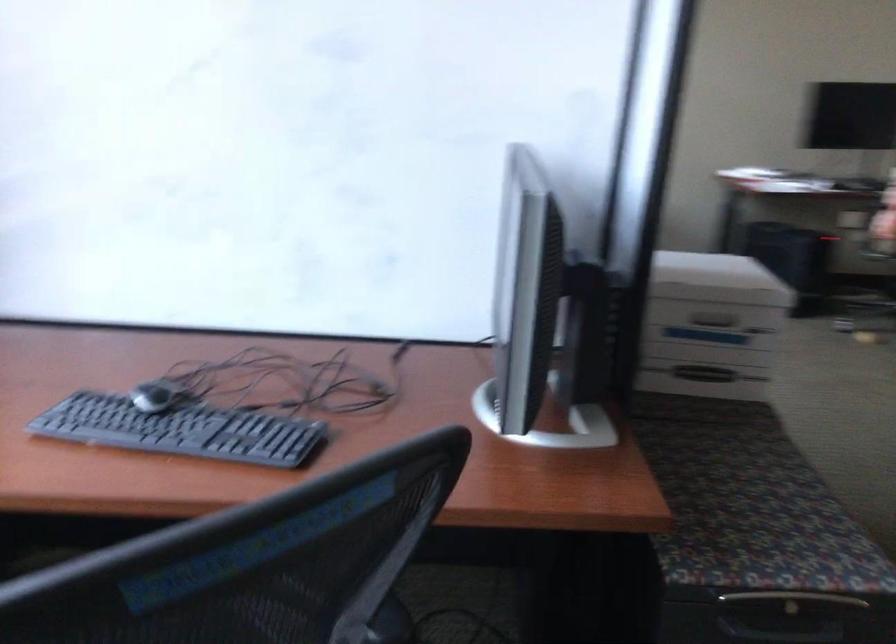
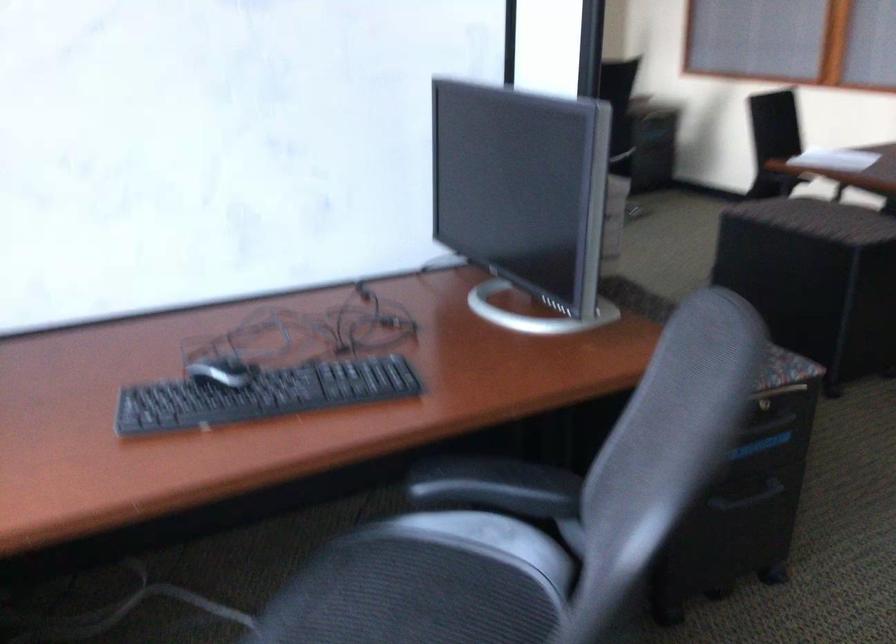
Question: In a continuous first-person perspective shot, in which direction is the camera moving?

Choices:
 (A) Left
 (B) Right
 (C) Forward
 (D) Backward

Answer: (A)